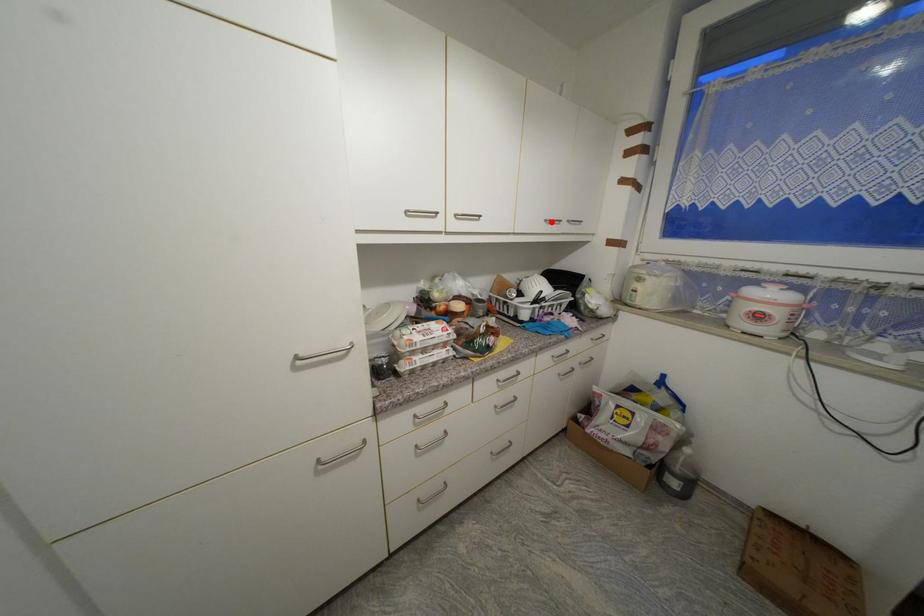
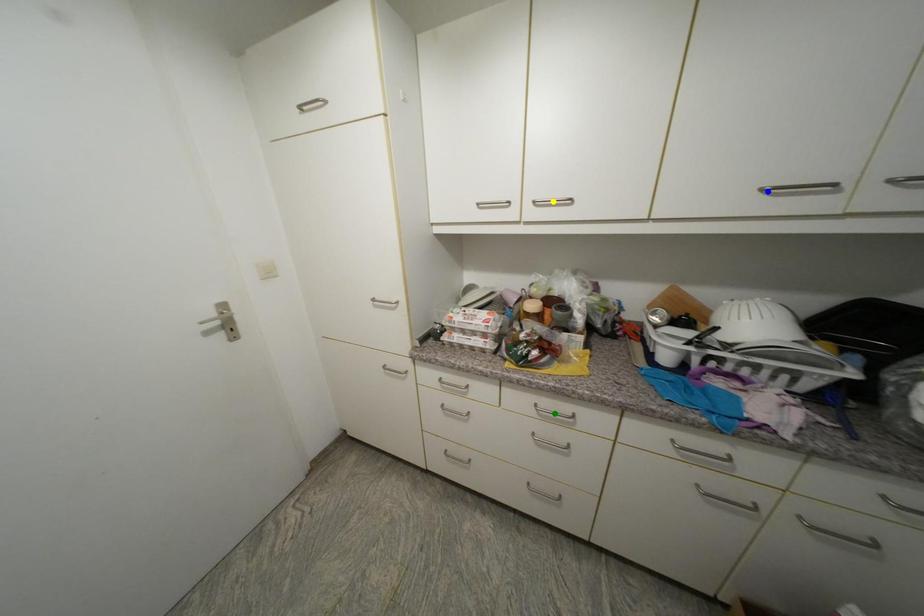
Question: I am providing you with two images of the same scene from different viewpoints. A red point is marked on the first image. You are given multiple points on the second image. In image 2, which mark is for the same physical point as the one in image 1?

Choices:
 (A) blue point
 (B) yellow point
 (C) green point

Answer: (A)